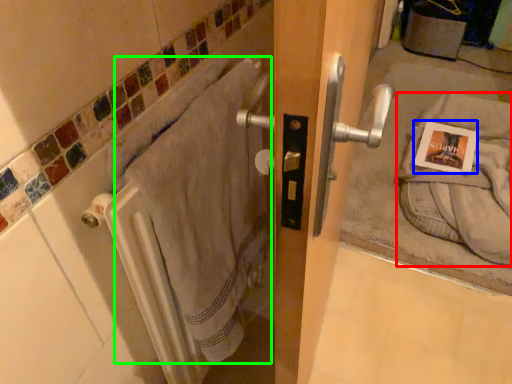
Question: Which object is positioned closest to bath towel (highlighted by a red box)? Select from postcard (highlighted by a blue box) and bath towel (highlighted by a green box).

Choices:
 (A) postcard
 (B) bath towel

Answer: (A)